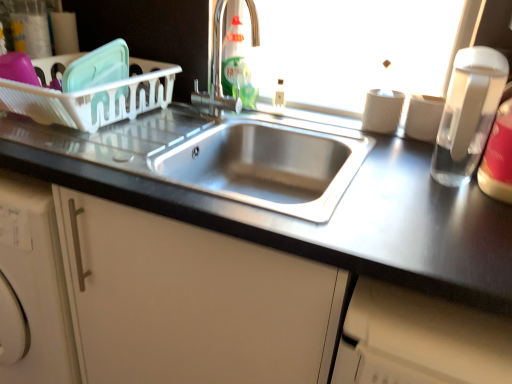
What do you see at coordinates (191, 301) in the screenshot? The width and height of the screenshot is (512, 384). I see `satin finish cabinet at center` at bounding box center [191, 301].

What do you see at coordinates (269, 166) in the screenshot? The image size is (512, 384). I see `stainless steel sink at center` at bounding box center [269, 166].

What is the approximate height of stainless steel sink at center?

stainless steel sink at center is 7.81 inches in height.

From the picture: What is the approximate height of clear plastic bottle at right, which appears as the 3th bottle when viewed from the top?

clear plastic bottle at right, which appears as the 3th bottle when viewed from the top, is 9.36 inches in height.

The width and height of the screenshot is (512, 384). What do you see at coordinates (498, 158) in the screenshot?
I see `clear plastic bottle at right, which is the 3th bottle from back to front` at bounding box center [498, 158].

What do you see at coordinates (216, 74) in the screenshot?
I see `satin nickel faucet at upper center` at bounding box center [216, 74].

What do you see at coordinates (233, 58) in the screenshot? The width and height of the screenshot is (512, 384). I see `translucent plastic bottle at upper center, acting as the 2th bottle starting from the front` at bounding box center [233, 58].

The height and width of the screenshot is (384, 512). Identify the location of clear glass water bottle at right. (468, 113).

Is clear glass water bottle at right surrounded by satin nickel faucet at upper center?

No.

Considering the positions of objects satin nickel faucet at upper center and clear glass water bottle at right in the image provided, who is more to the right, satin nickel faucet at upper center or clear glass water bottle at right?

clear glass water bottle at right.

What's the angular difference between satin nickel faucet at upper center and clear glass water bottle at right's facing directions?

There is a 31.3-degree angle between the facing directions of satin nickel faucet at upper center and clear glass water bottle at right.

From the picture: Is translucent plastic bottle at upper center, the 2th bottle positioned from the back, bigger than satin finish cabinet at center?

No, translucent plastic bottle at upper center, the 2th bottle positioned from the back, is not bigger than satin finish cabinet at center.

Which of these two, translucent plastic bottle at upper center, acting as the 2th bottle starting from the front, or satin finish cabinet at center, is wider?

With larger width is satin finish cabinet at center.

From a real-world perspective, is translucent plastic bottle at upper center, acting as the 3th bottle starting from the bottom, under satin finish cabinet at center?

Incorrect, from a real-world perspective, translucent plastic bottle at upper center, acting as the 3th bottle starting from the bottom, is higher than satin finish cabinet at center.

Considering the positions of points (241, 26) and (165, 219), is point (241, 26) closer to camera compared to point (165, 219)?

No, it is behind (165, 219).

Visually, is translucent green liquid at sink center, arranged as the second bottle when ordered from the bottom, positioned to the left or to the right of clear plastic bottle at right, the first bottle viewed from the right?

translucent green liquid at sink center, arranged as the second bottle when ordered from the bottom, is to the left of clear plastic bottle at right, the first bottle viewed from the right.

Is translucent green liquid at sink center, positioned as the 3th bottle in front-to-back order, in front of or behind clear plastic bottle at right, the first bottle viewed from the right, in the image?

Clearly, translucent green liquid at sink center, positioned as the 3th bottle in front-to-back order, is behind clear plastic bottle at right, the first bottle viewed from the right.

From a real-world perspective, who is located lower, translucent green liquid at sink center, positioned as the 3th bottle in front-to-back order, or clear plastic bottle at right, which appears as the 3th bottle when viewed from the top?

translucent green liquid at sink center, positioned as the 3th bottle in front-to-back order.

Which of these two, translucent green liquid at sink center, which is the second bottle from right to left, or clear plastic bottle at right, which ranks as the first bottle in front-to-back order, is bigger?

With larger size is clear plastic bottle at right, which ranks as the first bottle in front-to-back order.

Are stainless steel sink at center and satin finish cabinet at center making contact?

They are not placed beside each other.

At what (x,y) coordinates should I click in order to perform the action: click on sink on the right of satin finish cabinet at center. Please return your answer as a coordinate pair (x, y). Image resolution: width=512 pixels, height=384 pixels. Looking at the image, I should click on (269, 166).

Which of these two, stainless steel sink at center or satin finish cabinet at center, is bigger?

satin finish cabinet at center is bigger.

Does point (191, 147) lie in front of point (461, 180)?

No, it is behind (461, 180).

Are stainless steel sink at center and clear glass water bottle at right located far from each other?

stainless steel sink at center is near clear glass water bottle at right, not far away.

Considering the sizes of objects stainless steel sink at center and clear glass water bottle at right in the image provided, who is bigger, stainless steel sink at center or clear glass water bottle at right?

stainless steel sink at center is bigger.

Which of these two, clear glass water bottle at right or translucent plastic bottle at upper center, the 2th bottle positioned from the back, is wider?

With larger width is clear glass water bottle at right.

From their relative heights in the image, would you say clear glass water bottle at right is taller or shorter than translucent plastic bottle at upper center, the 3th bottle from the right?

Considering their sizes, clear glass water bottle at right has more height than translucent plastic bottle at upper center, the 3th bottle from the right.

Based on their sizes in the image, would you say clear glass water bottle at right is bigger or smaller than translucent plastic bottle at upper center, the 2th bottle positioned from the back?

In the image, clear glass water bottle at right appears to be larger than translucent plastic bottle at upper center, the 2th bottle positioned from the back.

The image size is (512, 384). Find the location of `cabinetry in front of the clear plastic bottle at right, which is the 3th bottle from back to front`. cabinetry in front of the clear plastic bottle at right, which is the 3th bottle from back to front is located at coordinates (191, 301).

Are satin finish cabinet at center and clear plastic bottle at right, which ranks as the first bottle in front-to-back order, far apart?

No, satin finish cabinet at center is in close proximity to clear plastic bottle at right, which ranks as the first bottle in front-to-back order.

Where is `tap behind the clear glass water bottle at right`? The image size is (512, 384). tap behind the clear glass water bottle at right is located at coordinates (216, 74).

The height and width of the screenshot is (384, 512). I want to click on cabinetry in front of the translucent plastic bottle at upper center, the 2th bottle positioned from the back, so click(x=191, y=301).

When comparing their distances from satin nickel faucet at upper center, does clear glass water bottle at right or translucent plastic bottle at upper center, acting as the first bottle starting from the top, seem further?

clear glass water bottle at right is positioned further to the anchor satin nickel faucet at upper center.

Which object lies further to the anchor point clear glass water bottle at right, translucent plastic bottle at upper center, the 1th bottle positioned from the left, or stainless steel sink at center?

translucent plastic bottle at upper center, the 1th bottle positioned from the left, is further to clear glass water bottle at right.

Looking at the image, which one is located further to clear plastic bottle at right, the 3th bottle viewed from the left, stainless steel sink at center or translucent green liquid at sink center, the first bottle viewed from the back?

translucent green liquid at sink center, the first bottle viewed from the back.

Based on the photo, based on their spatial positions, is stainless steel sink at center or clear glass water bottle at right closer to translucent green liquid at sink center, the first bottle viewed from the back?

stainless steel sink at center.

From the image, which object appears to be farther from clear plastic bottle at right, the 3th bottle viewed from the left, satin nickel faucet at upper center or clear glass water bottle at right?

The object further to clear plastic bottle at right, the 3th bottle viewed from the left, is satin nickel faucet at upper center.

Which object lies further to the anchor point clear plastic bottle at right, the 3th bottle viewed from the left, translucent plastic bottle at upper center, the 3th bottle from the right, or satin nickel faucet at upper center?

Based on the image, translucent plastic bottle at upper center, the 3th bottle from the right, appears to be further to clear plastic bottle at right, the 3th bottle viewed from the left.

Estimate the real-world distances between objects in this image. Which object is closer to satin finish cabinet at center, translucent plastic bottle at upper center, acting as the first bottle starting from the top, or translucent green liquid at sink center, the first bottle viewed from the back?

The object closer to satin finish cabinet at center is translucent green liquid at sink center, the first bottle viewed from the back.

When comparing their distances from clear glass water bottle at right, does clear plastic bottle at right, which appears as the 3th bottle when viewed from the top, or translucent plastic bottle at upper center, acting as the first bottle starting from the top, seem closer?

Based on the image, clear plastic bottle at right, which appears as the 3th bottle when viewed from the top, appears to be nearer to clear glass water bottle at right.

Locate an element on the screen. appliance between satin finish cabinet at center and clear plastic bottle at right, which is counted as the 1th bottle, starting from the bottom, in the horizontal direction is located at coordinates [468, 113].

Image resolution: width=512 pixels, height=384 pixels. Find the location of `tap located between translucent plastic bottle at upper center, acting as the 2th bottle starting from the front, and clear glass water bottle at right in the left-right direction`. tap located between translucent plastic bottle at upper center, acting as the 2th bottle starting from the front, and clear glass water bottle at right in the left-right direction is located at coordinates (216, 74).

This screenshot has width=512, height=384. In order to click on bottle situated between satin nickel faucet at upper center and clear plastic bottle at right, which is counted as the 1th bottle, starting from the bottom, from left to right in this screenshot , I will do `click(243, 83)`.

Find the location of a particular element. Image resolution: width=512 pixels, height=384 pixels. sink between translucent plastic bottle at upper center, the 1th bottle positioned from the left, and satin finish cabinet at center vertically is located at coordinates (269, 166).